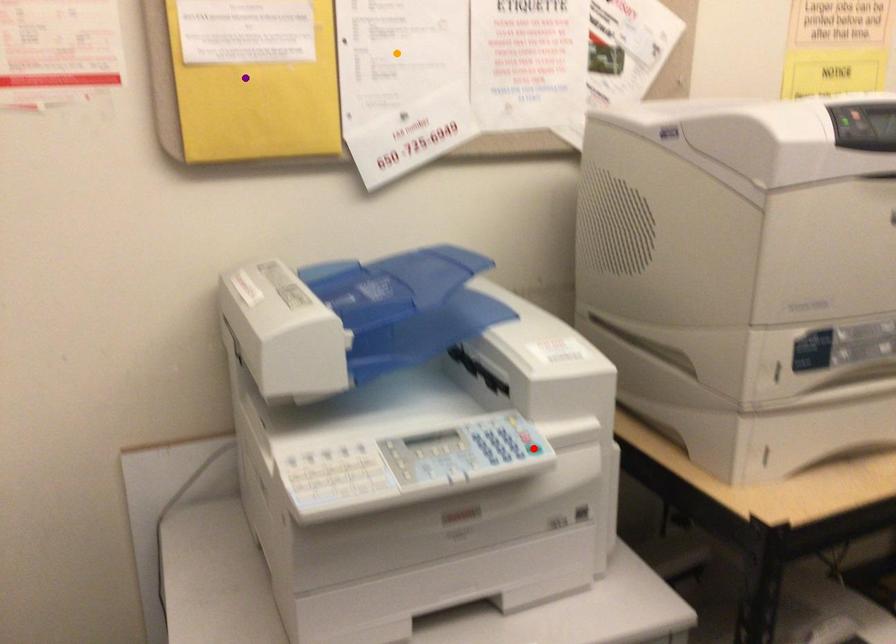
Order these from nearest to farthest:
purple point
red point
orange point

red point, purple point, orange point